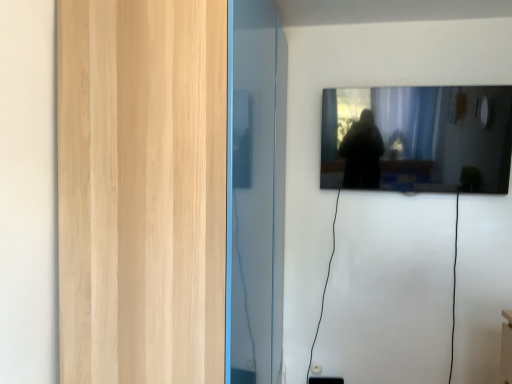
Question: Based on their positions, is transparent glass door at left located to the left or right of black glossy mirror at upper right?

Choices:
 (A) left
 (B) right

Answer: (A)

Question: From their relative heights in the image, would you say transparent glass door at left is taller or shorter than black glossy mirror at upper right?

Choices:
 (A) tall
 (B) short

Answer: (A)

Question: Considering their positions, is transparent glass door at left located in front of or behind black glossy mirror at upper right?

Choices:
 (A) front
 (B) behind

Answer: (A)

Question: From the image's perspective, is black glossy mirror at upper right above or below transparent glass door at left?

Choices:
 (A) above
 (B) below

Answer: (A)

Question: From a real-world perspective, relative to transparent glass door at left, is black glossy mirror at upper right vertically above or below?

Choices:
 (A) above
 (B) below

Answer: (A)

Question: Would you say black glossy mirror at upper right is inside or outside transparent glass door at left?

Choices:
 (A) outside
 (B) inside

Answer: (A)

Question: Is point (462, 188) closer or farther from the camera than point (217, 233)?

Choices:
 (A) closer
 (B) farther

Answer: (B)